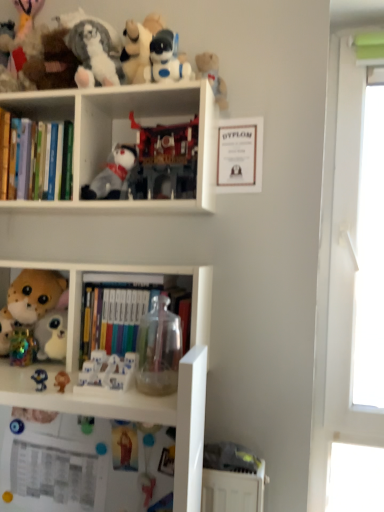
Question: From the image's perspective, does fluffy plush toy at left, the seventh toy from the bottom, appear lower than white plastic robot at upper center, the second toy positioned from the top?

Choices:
 (A) no
 (B) yes

Answer: (B)

Question: Can you confirm if fluffy plush toy at left, marked as the 5th toy in a top-to-bottom arrangement, is positioned to the right of white plastic robot at upper center, the second toy positioned from the top?

Choices:
 (A) no
 (B) yes

Answer: (A)

Question: From a real-world perspective, is fluffy plush toy at left, marked as the 5th toy in a top-to-bottom arrangement, physically below white plastic robot at upper center, the second toy positioned from the top?

Choices:
 (A) yes
 (B) no

Answer: (A)

Question: Considering the relative sizes of fluffy plush toy at left, marked as the 5th toy in a top-to-bottom arrangement, and white plastic robot at upper center, the second toy positioned from the top, in the image provided, is fluffy plush toy at left, marked as the 5th toy in a top-to-bottom arrangement, thinner than white plastic robot at upper center, the second toy positioned from the top,?

Choices:
 (A) yes
 (B) no

Answer: (B)

Question: From a real-world perspective, is fluffy plush toy at left, the seventh toy from the bottom, on white plastic robot at upper center, the second toy positioned from the top?

Choices:
 (A) no
 (B) yes

Answer: (A)

Question: Is point (322, 185) closer or farther from the camera than point (3, 346)?

Choices:
 (A) farther
 (B) closer

Answer: (B)

Question: From the image's perspective, is transparent plastic window at right above or below fluffy plush toy at left, marked as the 5th toy in a top-to-bottom arrangement?

Choices:
 (A) below
 (B) above

Answer: (B)

Question: Is transparent plastic window at right spatially inside fluffy plush toy at left, marked as the 5th toy in a top-to-bottom arrangement, or outside of it?

Choices:
 (A) inside
 (B) outside

Answer: (B)

Question: From a real-world perspective, relative to fluffy plush toy at left, the seventh toy from the bottom, is transparent plastic window at right vertically above or below?

Choices:
 (A) below
 (B) above

Answer: (B)

Question: Choose the correct answer: Is white plush toy at center, which is counted as the 4th toy, starting from the top, inside fluffy plush toy at left, the seventh toy from the bottom, or outside it?

Choices:
 (A) inside
 (B) outside

Answer: (B)

Question: From a real-world perspective, is white plush toy at center, the eighth toy in the bottom-to-top sequence, physically located above or below fluffy plush toy at left, marked as the 5th toy in a top-to-bottom arrangement?

Choices:
 (A) below
 (B) above

Answer: (B)

Question: Looking at their shapes, would you say white plush toy at center, which is counted as the 4th toy, starting from the top, is wider or thinner than fluffy plush toy at left, the seventh toy from the bottom?

Choices:
 (A) wide
 (B) thin

Answer: (B)

Question: Does point (109, 195) appear closer or farther from the camera than point (56, 352)?

Choices:
 (A) farther
 (B) closer

Answer: (B)

Question: From the image's perspective, relative to white plastic bookshelf at upper center, is white plastic figurines at center, which appears as the eighth toy when viewed from the top, above or below?

Choices:
 (A) above
 (B) below

Answer: (B)

Question: Do you think white plastic figurines at center, which appears as the fourth toy when ordered from the bottom, is within white plastic bookshelf at upper center, or outside of it?

Choices:
 (A) outside
 (B) inside

Answer: (A)